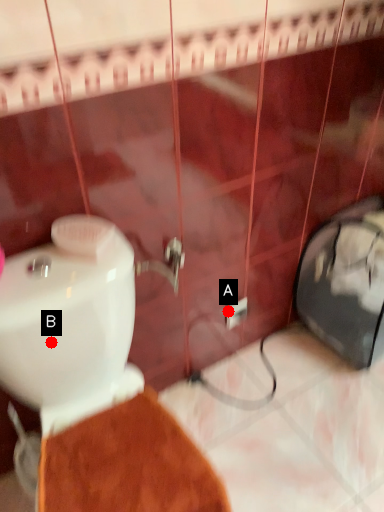
Question: Two points are circled on the image, labeled by A and B beside each circle. Which point is closer to the camera?

Choices:
 (A) A is closer
 (B) B is closer

Answer: (B)